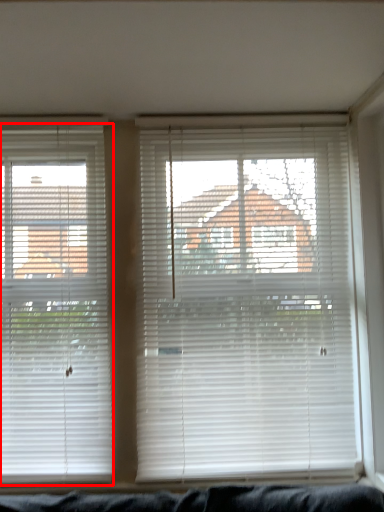
Question: Where is window blind (annotated by the red box) located in relation to window blind in the image?

Choices:
 (A) right
 (B) left

Answer: (B)